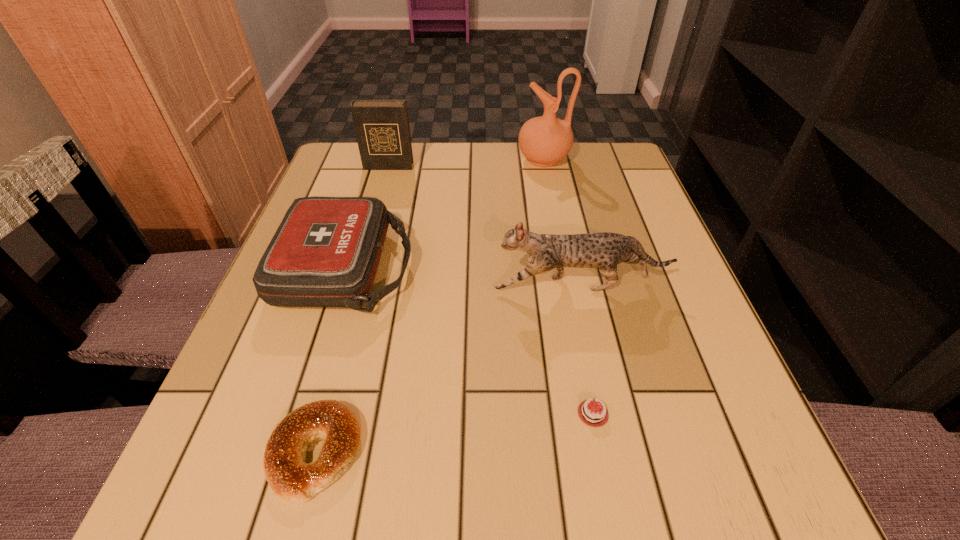
Find the location of a particular element. The width and height of the screenshot is (960, 540). free location located 0.210m on the face of the third tallest object is located at coordinates tap(382, 286).

Where is `vacant space located on the face of the third tallest object`? This screenshot has width=960, height=540. vacant space located on the face of the third tallest object is located at coordinates (430, 286).

Locate an element on the screen. The width and height of the screenshot is (960, 540). free space located on the face of the third tallest object is located at coordinates (387, 286).

Image resolution: width=960 pixels, height=540 pixels. What are the coordinates of `vacant position located on the front of the fourth tallest object` in the screenshot? It's located at (290, 451).

At what (x,y) coordinates should I click in order to perform the action: click on vacant space located 0.050m on the left of the bagel. Please return your answer as a coordinate pair (x, y). The width and height of the screenshot is (960, 540). Looking at the image, I should click on (234, 452).

At what (x,y) coordinates should I click in order to perform the action: click on free space located 0.350m on the left of the shortest object. Please return your answer as a coordinate pair (x, y). The image size is (960, 540). Looking at the image, I should click on (315, 414).

You are a GUI agent. You are given a task and a screenshot of the screen. Output one action in this format:
    pyautogui.click(x=<x>, y=<y>)
    Task: Click on the pottery at the far edge
    The width and height of the screenshot is (960, 540).
    Given the screenshot: What is the action you would take?
    pyautogui.click(x=544, y=140)

Where is `diary that is positioned at the far edge`? The height and width of the screenshot is (540, 960). diary that is positioned at the far edge is located at coordinates (382, 129).

Locate an element on the screen. The height and width of the screenshot is (540, 960). object located in the near edge section of the desktop is located at coordinates (289, 476).

Where is `diary at the left edge`? The width and height of the screenshot is (960, 540). diary at the left edge is located at coordinates (382, 129).